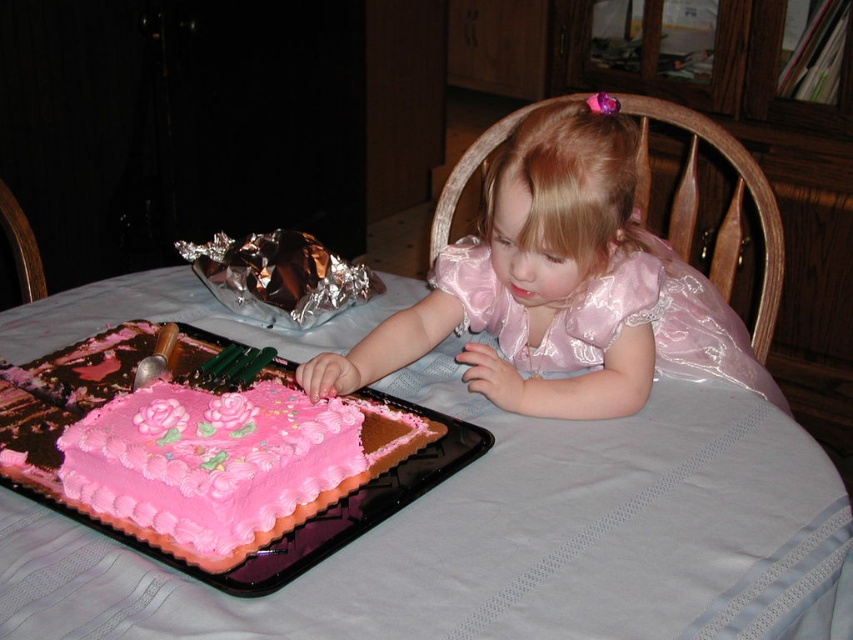
Which is below, pink frosted cake at lower left or pink shiny dress at upper center?

pink frosted cake at lower left is lower down.

Looking at this image, does pink frosted cake at lower left have a lesser height compared to pink shiny dress at upper center?

Indeed, pink frosted cake at lower left has a lesser height compared to pink shiny dress at upper center.

What do you see at coordinates (160, 538) in the screenshot? I see `pink frosted cake at lower left` at bounding box center [160, 538].

Where is `pink frosted cake at lower left`? pink frosted cake at lower left is located at coordinates (160, 538).

This screenshot has height=640, width=853. Describe the element at coordinates (558, 284) in the screenshot. I see `pink satin dress at center` at that location.

Which is more to the right, pink satin dress at center or shiny metallic foil at center?

From the viewer's perspective, pink satin dress at center appears more on the right side.

Is point (612, 355) positioned behind point (294, 308)?

No, it is not.

Find the location of a particular element. This screenshot has width=853, height=640. pink satin dress at center is located at coordinates (558, 284).

Does white cloth table at center have a lesser width compared to pink frosted cake at lower left?

No, white cloth table at center is not thinner than pink frosted cake at lower left.

Does white cloth table at center have a smaller size compared to pink frosted cake at lower left?

Actually, white cloth table at center might be larger than pink frosted cake at lower left.

Is point (706, 442) behind point (357, 516)?

Yes, it is.

I want to click on white cloth table at center, so click(x=512, y=540).